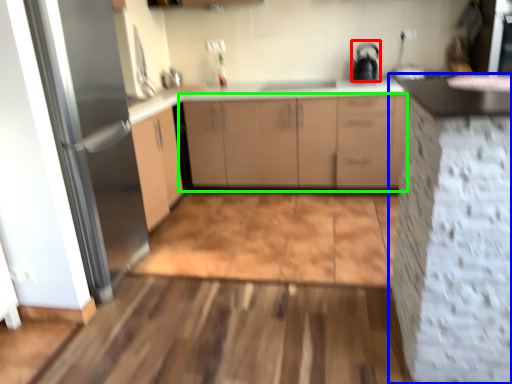
Question: Which is farther away from appliance (highlighted by a red box)? cabinetry (highlighted by a blue box) or cabinetry (highlighted by a green box)?

Choices:
 (A) cabinetry
 (B) cabinetry

Answer: (A)